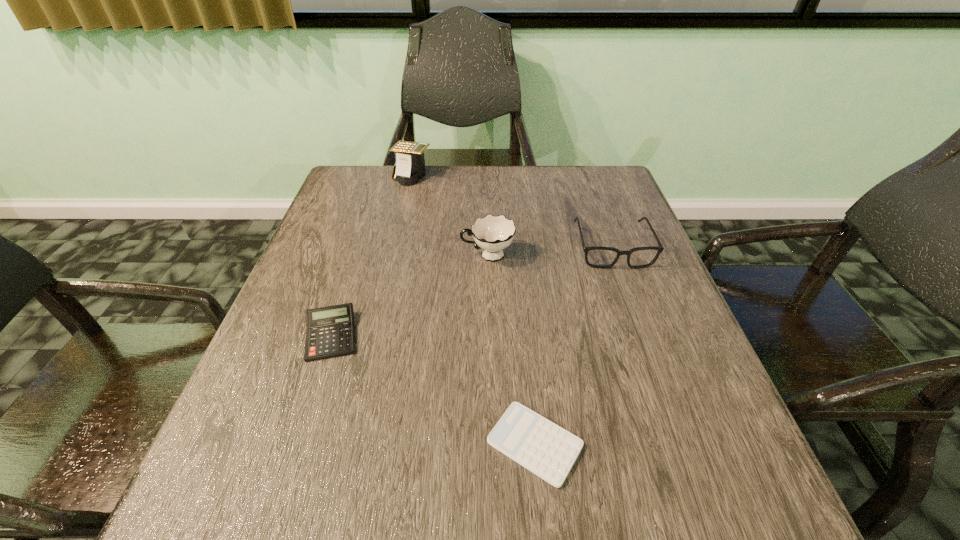
Locate an element on the screen. This screenshot has height=540, width=960. the tallest calculator is located at coordinates (410, 163).

This screenshot has height=540, width=960. What are the coordinates of `the farthest calculator` in the screenshot? It's located at click(410, 163).

At what (x,y) coordinates should I click in order to perform the action: click on cup. Please return your answer as a coordinate pair (x, y). Looking at the image, I should click on (492, 233).

In order to click on the rightmost object in this screenshot , I will do `click(598, 257)`.

At what (x,y) coordinates should I click in order to perform the action: click on the third tallest object. Please return your answer as a coordinate pair (x, y). Looking at the image, I should click on (598, 257).

This screenshot has height=540, width=960. I want to click on the second shortest calculator, so click(x=330, y=333).

Find the location of a particular element. the second nearest object is located at coordinates (330, 333).

Identify the location of the nearest calculator. (547, 450).

Find the location of `the rightmost calculator`. the rightmost calculator is located at coordinates (547, 450).

At what (x,y) coordinates should I click in order to perform the action: click on vacant space located on the front of the farthest calculator. Please return your answer as a coordinate pair (x, y). This screenshot has height=540, width=960. Looking at the image, I should click on (405, 205).